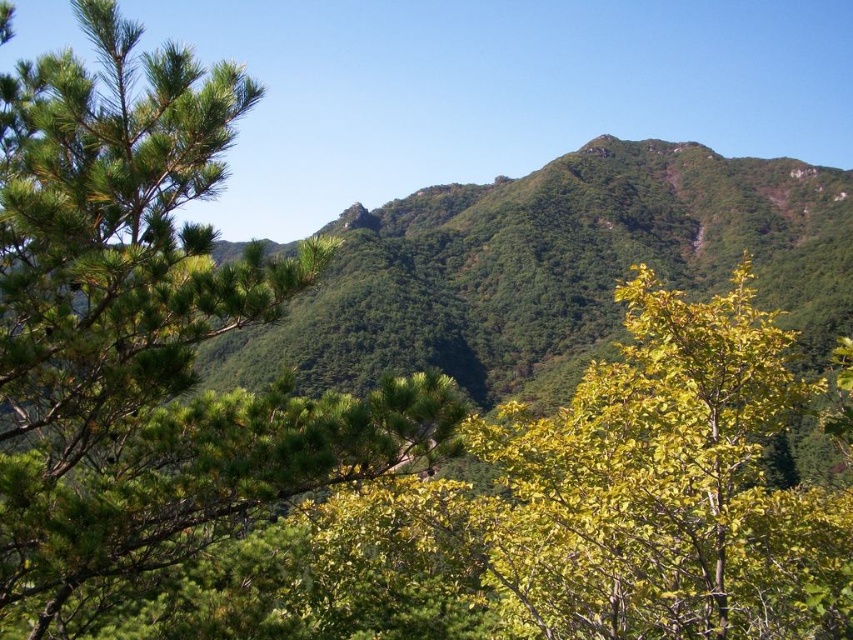
Question: Does green matte tree at left have a larger size compared to green leafy tree at center?

Choices:
 (A) yes
 (B) no

Answer: (B)

Question: Which of the following is the farthest from the observer?

Choices:
 (A) green leafy tree at center
 (B) green matte tree at left

Answer: (A)

Question: From the image, what is the correct spatial relationship of green matte tree at left in relation to green leafy tree at center?

Choices:
 (A) right
 (B) left

Answer: (B)

Question: Is green matte tree at left to the left of green leafy tree at center from the viewer's perspective?

Choices:
 (A) no
 (B) yes

Answer: (B)

Question: Which point is farther to the camera?

Choices:
 (A) [x=51, y=154]
 (B) [x=701, y=333]

Answer: (B)